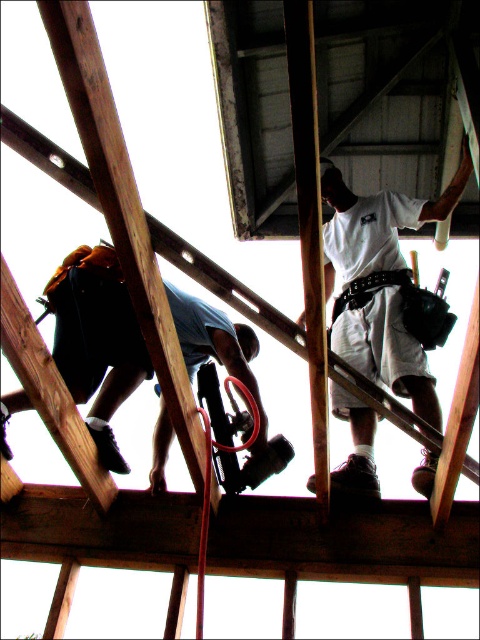
Does point (107, 272) lie in front of point (360, 490)?

No, it is behind (360, 490).

Who is positioned more to the right, blue denim jeans at lower left or white fabric construction worker at upper center?

white fabric construction worker at upper center

Does point (277, 435) come farther from viewer compared to point (422, 412)?

That is False.

You are a GUI agent. You are given a task and a screenshot of the screen. Output one action in this format:
    pyautogui.click(x=<x>, y=<y>)
    Task: Click on the blue denim jeans at lower left
    The width and height of the screenshot is (480, 640).
    Given the screenshot: What is the action you would take?
    pyautogui.click(x=96, y=340)